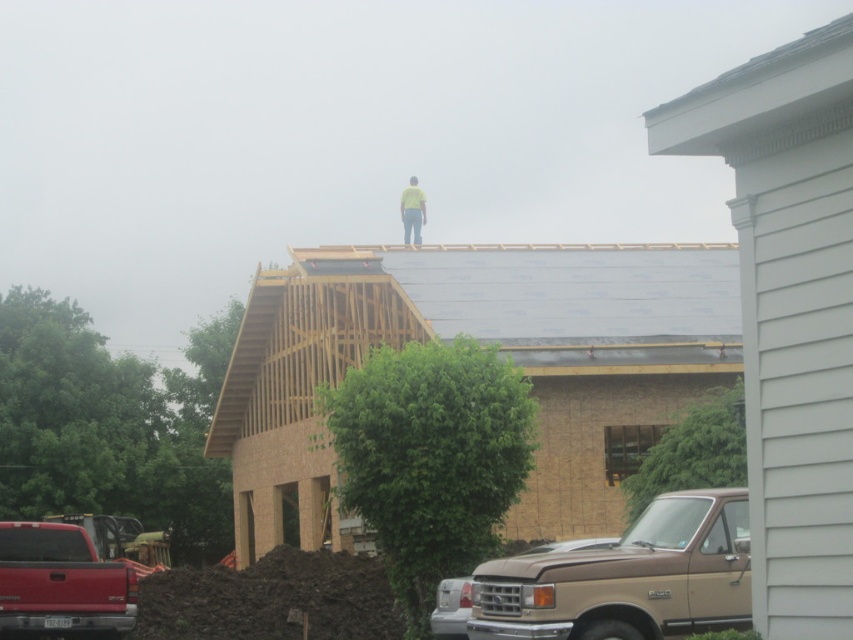
Does brown matte pickup truck at lower center have a smaller size compared to yellow fabric construction worker at upper center?

Yes, brown matte pickup truck at lower center is smaller than yellow fabric construction worker at upper center.

In the scene shown: Who is positioned more to the left, brown matte pickup truck at lower center or yellow fabric construction worker at upper center?

yellow fabric construction worker at upper center

Is point (662, 616) behind point (412, 232)?

No.

You are a GUI agent. You are given a task and a screenshot of the screen. Output one action in this format:
    pyautogui.click(x=<x>, y=<y>)
    Task: Click on the brown matte pickup truck at lower center
    This screenshot has width=853, height=640.
    Given the screenshot: What is the action you would take?
    pyautogui.click(x=628, y=579)

Where is `brown matte pickup truck at lower center`? brown matte pickup truck at lower center is located at coordinates (628, 579).

Does brown matte pickup truck at lower center have a lesser width compared to matte red truck at lower left?

No, brown matte pickup truck at lower center is not thinner than matte red truck at lower left.

Where is `brown matte pickup truck at lower center`? This screenshot has height=640, width=853. brown matte pickup truck at lower center is located at coordinates tap(628, 579).

At what (x,y) coordinates should I click in order to perform the action: click on brown matte pickup truck at lower center. Please return your answer as a coordinate pair (x, y). Image resolution: width=853 pixels, height=640 pixels. Looking at the image, I should click on (628, 579).

Who is lower down, gray asphalt shingles at center or brown matte pickup truck at lower center?

brown matte pickup truck at lower center is lower down.

Is point (370, 320) closer to camera compared to point (587, 598)?

No, it is behind (587, 598).

Image resolution: width=853 pixels, height=640 pixels. I want to click on gray asphalt shingles at center, so click(476, 316).